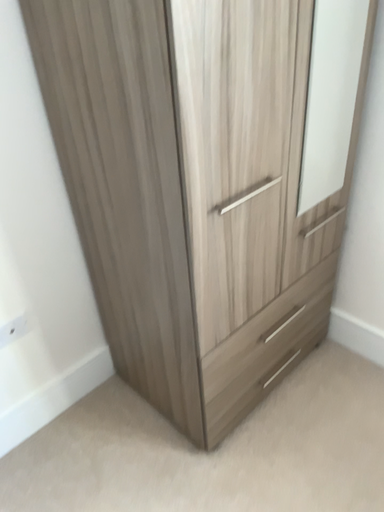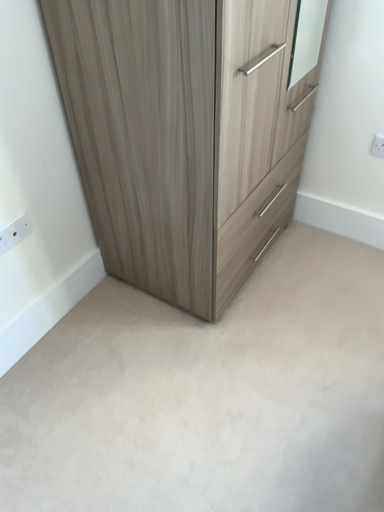
Question: Which way did the camera rotate in the video?

Choices:
 (A) rotated right
 (B) rotated left

Answer: (A)